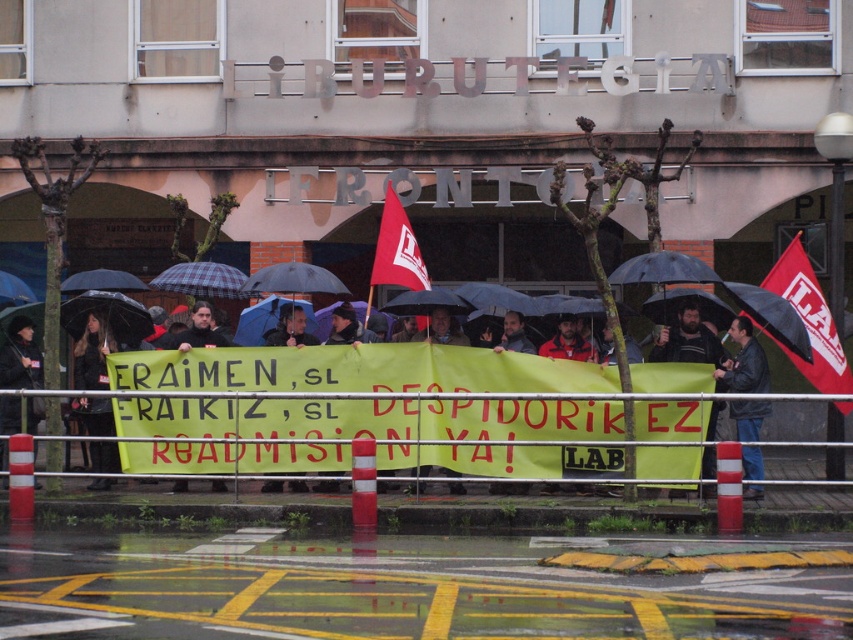
You are a photographer trying to capture a clear shot of the protest. You have a camera with a wide angle lens that can capture a horizontal field of view of 60 degrees. The black leather jacket at right and the red fabric flag at center are both in your frame. Based on their positions, can you determine which object is closer to the left edge of your photo?

The black leather jacket at right is positioned on the right side of the red fabric flag at center. Since the red fabric flag at center is closer to the center of the frame, the black leather jacket at right is further to the right. Therefore, the red fabric flag at center is closer to the left edge of the photo than the black leather jacket at right.

You are a photographer at the protest scene. You want to take a photo of the matte black jacket at center and the red fabric flag at upper right. Which object is positioned to the right of the other?

The red fabric flag at upper right is positioned to the right of the matte black jacket at center.

What is the size relationship between the red fabric flag at upper right and the matte black jacket at center?

The red fabric flag at upper right is larger in size than the matte black jacket at center.